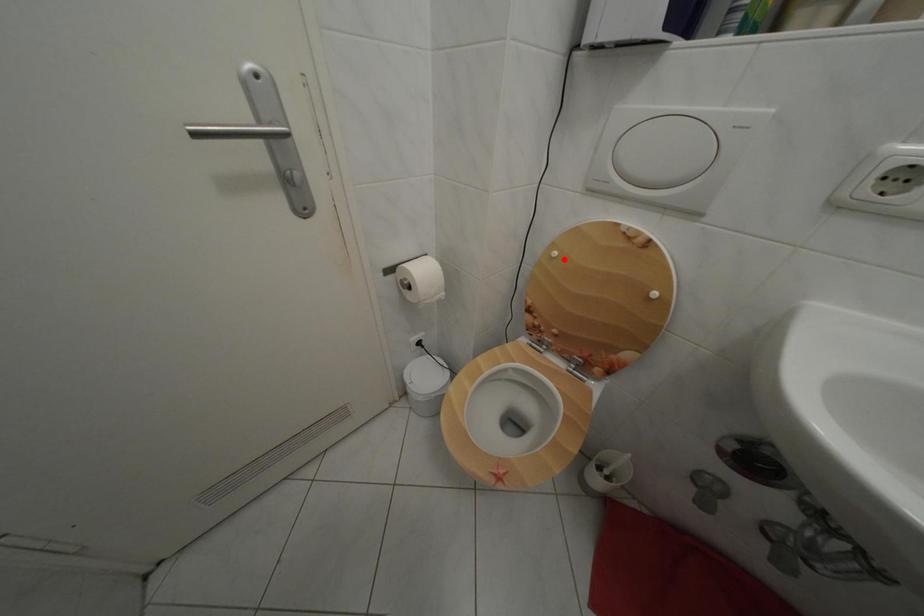
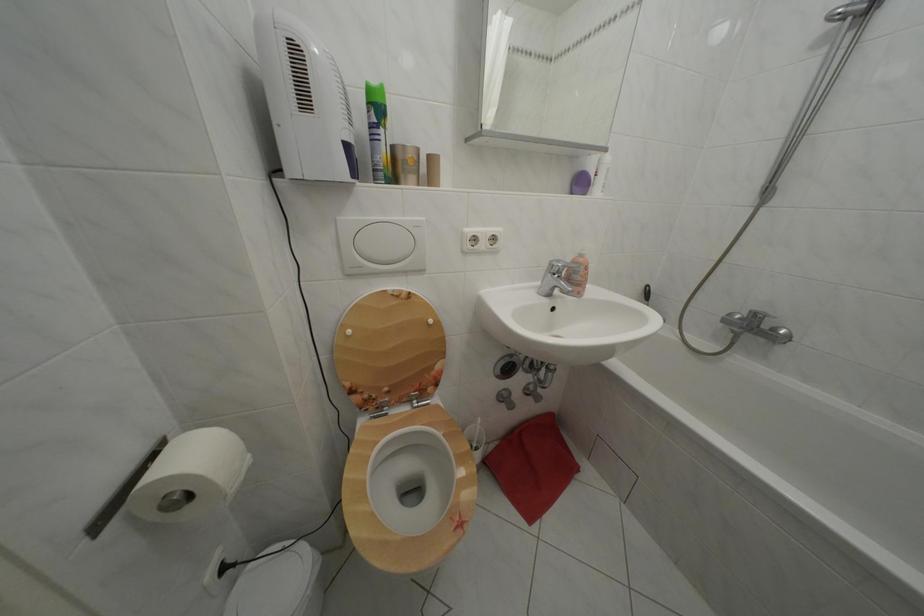
In the second image, find the point that corresponds to the highlighted location in the first image.

(358, 338)